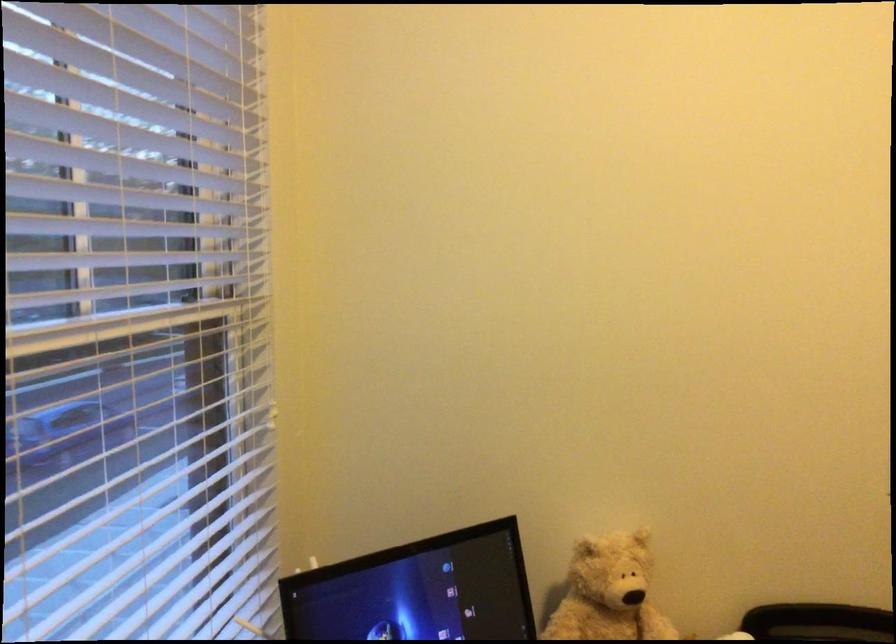
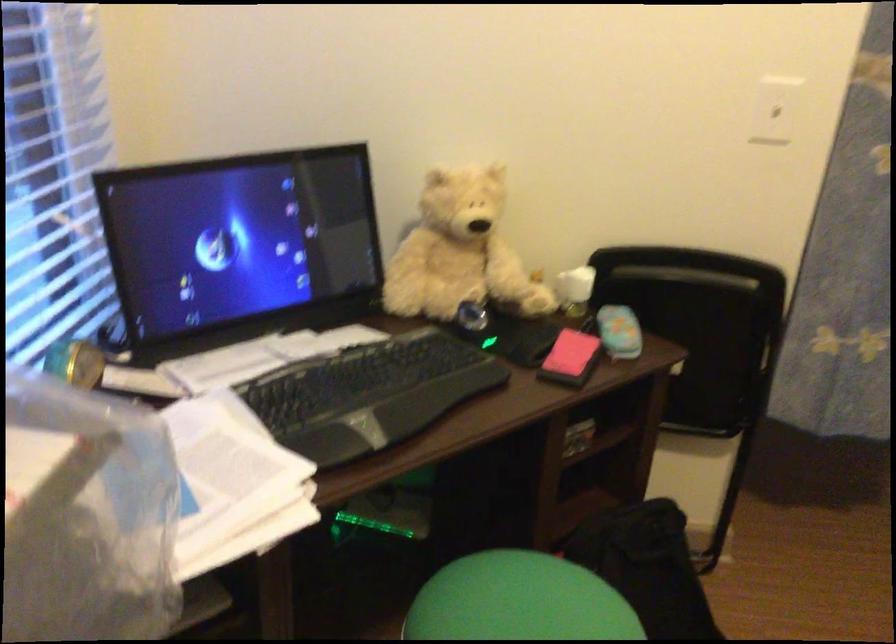
Question: Which direction would the cameraman need to move to produce the second image? Reply with the corresponding letter.

Choices:
 (A) Left
 (B) Right
 (C) Forward
 (D) Backward

Answer: (B)